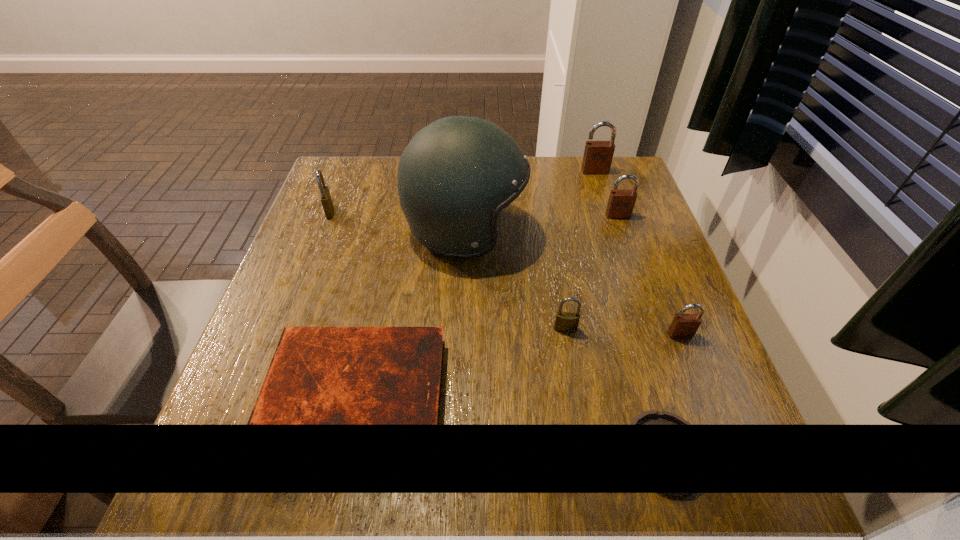
The width and height of the screenshot is (960, 540). I want to click on football helmet at the far edge, so click(455, 176).

Locate an element on the screen. Image resolution: width=960 pixels, height=540 pixels. Bible at the near edge is located at coordinates (318, 375).

This screenshot has height=540, width=960. Find the location of `ashtray at the near edge`. ashtray at the near edge is located at coordinates (652, 417).

I want to click on padlock located in the left edge section of the desktop, so click(325, 197).

In order to click on Bible at the left edge in this screenshot , I will do `click(318, 375)`.

I want to click on ashtray at the right edge, so click(652, 417).

Image resolution: width=960 pixels, height=540 pixels. Find the location of `object that is at the far left corner`. object that is at the far left corner is located at coordinates (325, 197).

At what (x,y) coordinates should I click in order to perform the action: click on object that is at the near left corner. Please return your answer as a coordinate pair (x, y). Looking at the image, I should click on (318, 375).

Where is `object that is at the far right corner`? This screenshot has height=540, width=960. object that is at the far right corner is located at coordinates (598, 155).

You are a GUI agent. You are given a task and a screenshot of the screen. Output one action in this format:
    pyautogui.click(x=<x>, y=<y>)
    Task: Click on the object at the near right corner
    The height and width of the screenshot is (540, 960).
    Given the screenshot: What is the action you would take?
    pyautogui.click(x=652, y=417)